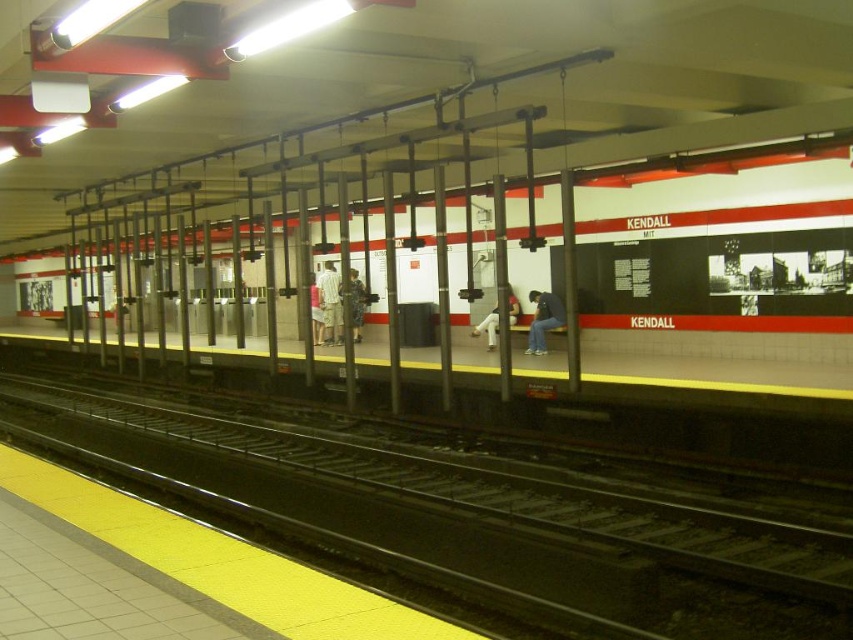
You are a commuter waiting at the Kendall MIT subway station platform. You notice a light gray shorts at center and a denim jacket at center. Which item is placed above the other?

The light gray shorts at center is positioned over the denim jacket at center.

You are a passenger waiting at the Kendall MIT subway station platform. You notice the black metal track at center and the light brown fabric shorts at center. Which object takes up more space on the platform?

The black metal track at center is larger in size than the light brown fabric shorts at center, so the black metal track at center takes up more space on the platform.

You are standing on the Kendall MIT subway station platform and notice two people wearing light gray shorts at center and denim pants at center. Which person is closer to you?

The light gray shorts at center is closer to you because it is further to the viewer than denim pants at center.